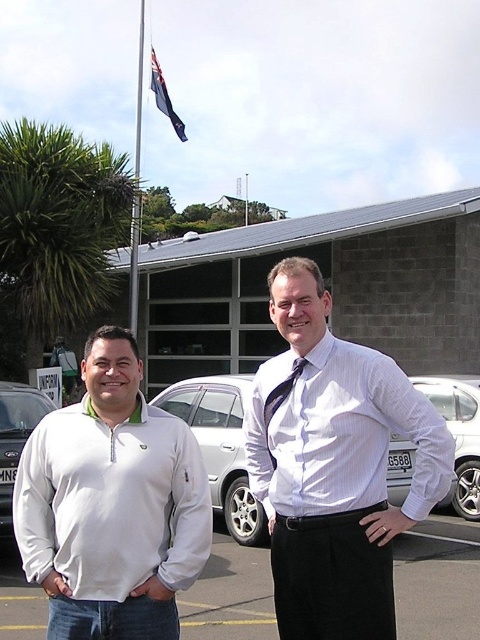
Does white matte sedan at left have a smaller size compared to metallic flag pole at upper center?

Correct, white matte sedan at left occupies less space than metallic flag pole at upper center.

Is white matte sedan at left wider than metallic flag pole at upper center?

Incorrect, white matte sedan at left's width does not surpass metallic flag pole at upper center's.

Where is `white matte sedan at left`? white matte sedan at left is located at coordinates (15, 438).

Is point (302, 285) positioned behind point (164, 92)?

No, it is not.

Can you confirm if white striped shirt at center is thinner than blue fabric flag at upper center?

Yes.

Between point (349, 476) and point (182, 132), which one is positioned in front?

Positioned in front is point (349, 476).

Locate an element on the screen. Image resolution: width=480 pixels, height=640 pixels. white striped shirt at center is located at coordinates (335, 465).

Who is positioned more to the right, white matte sedan at left or black satin tie at center?

black satin tie at center is more to the right.

Is white matte sedan at left positioned in front of black satin tie at center?

No, white matte sedan at left is further to the viewer.

Is point (31, 392) farther from camera compared to point (288, 376)?

Yes, it is.

Locate an element on the screen. The height and width of the screenshot is (640, 480). white matte sedan at left is located at coordinates (15, 438).